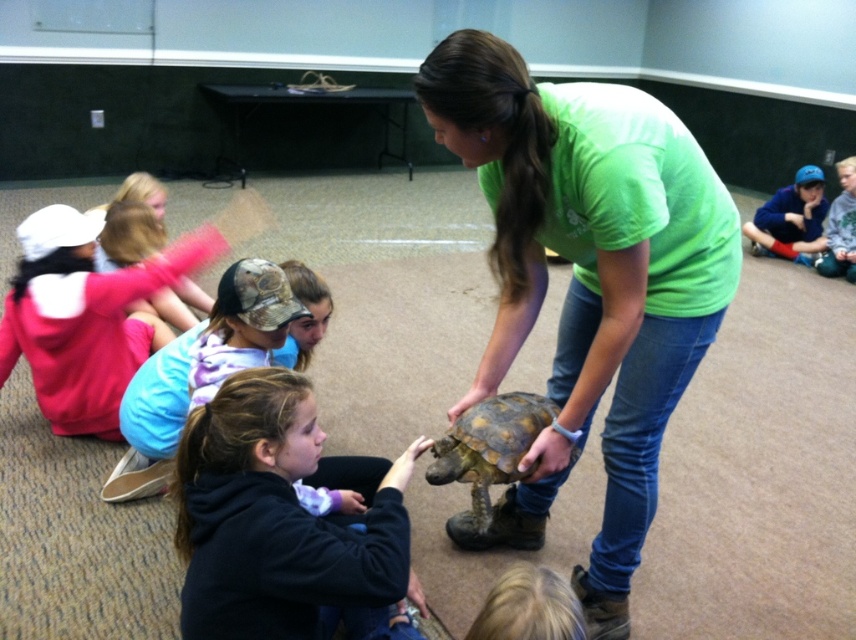
Question: Which object is the farthest from the dark blue hoodie at lower center?

Choices:
 (A) blue fleece jacket at upper right
 (B) green matte shirt at center
 (C) yellowish-brown scaly tortoise at center
 (D) matte pink hoodie at lower left

Answer: (A)

Question: Which of the following is the closest to the observer?

Choices:
 (A) dark blue hoodie at lower center
 (B) green matte shirt at center
 (C) blue fleece jacket at upper right

Answer: (A)

Question: Where is dark blue hoodie at lower center located in relation to matte pink hoodie at lower left in the image?

Choices:
 (A) below
 (B) above

Answer: (A)

Question: Is dark blue hoodie at lower center to the left of blue fleece jacket at upper right from the viewer's perspective?

Choices:
 (A) yes
 (B) no

Answer: (A)

Question: Among these objects, which one is farthest from the camera?

Choices:
 (A) blue fleece jacket at upper right
 (B) dark blue hoodie at lower center

Answer: (A)

Question: Does matte pink hoodie at lower left have a greater width compared to yellowish-brown scaly tortoise at center?

Choices:
 (A) yes
 (B) no

Answer: (A)